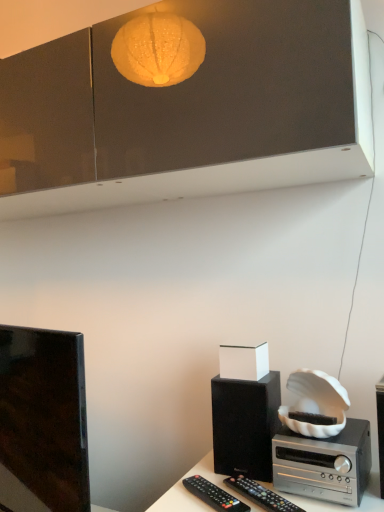
Question: Considering the relative positions of silver metallic stereo at lower right and black matte speaker at right in the image provided, is silver metallic stereo at lower right to the right of black matte speaker at right from the viewer's perspective?

Choices:
 (A) yes
 (B) no

Answer: (B)

Question: Is silver metallic stereo at lower right to the left of black matte speaker at right from the viewer's perspective?

Choices:
 (A) yes
 (B) no

Answer: (A)

Question: Is the surface of silver metallic stereo at lower right in direct contact with black matte speaker at right?

Choices:
 (A) no
 (B) yes

Answer: (A)

Question: Does silver metallic stereo at lower right have a greater height compared to black matte speaker at right?

Choices:
 (A) no
 (B) yes

Answer: (A)

Question: Is silver metallic stereo at lower right outside of black matte speaker at right?

Choices:
 (A) yes
 (B) no

Answer: (A)

Question: Is silver metallic stereo at lower right further to camera compared to black matte speaker at right?

Choices:
 (A) no
 (B) yes

Answer: (B)

Question: Is shiny black tv at left positioned in front of black matte speaker at right?

Choices:
 (A) yes
 (B) no

Answer: (B)

Question: Does shiny black tv at left have a lesser width compared to black matte speaker at right?

Choices:
 (A) no
 (B) yes

Answer: (B)

Question: Is shiny black tv at left taller than black matte speaker at right?

Choices:
 (A) yes
 (B) no

Answer: (A)

Question: Is black matte speaker at right inside shiny black tv at left?

Choices:
 (A) no
 (B) yes

Answer: (A)

Question: From the image's perspective, is shiny black tv at left under black matte speaker at right?

Choices:
 (A) no
 (B) yes

Answer: (B)

Question: Considering the relative sizes of shiny black tv at left and black matte speaker at right in the image provided, is shiny black tv at left smaller than black matte speaker at right?

Choices:
 (A) no
 (B) yes

Answer: (A)

Question: Would you say black matte speaker at lower right is outside black plastic remote control at lower center, the 1th remote control in the left-to-right sequence?

Choices:
 (A) no
 (B) yes

Answer: (B)